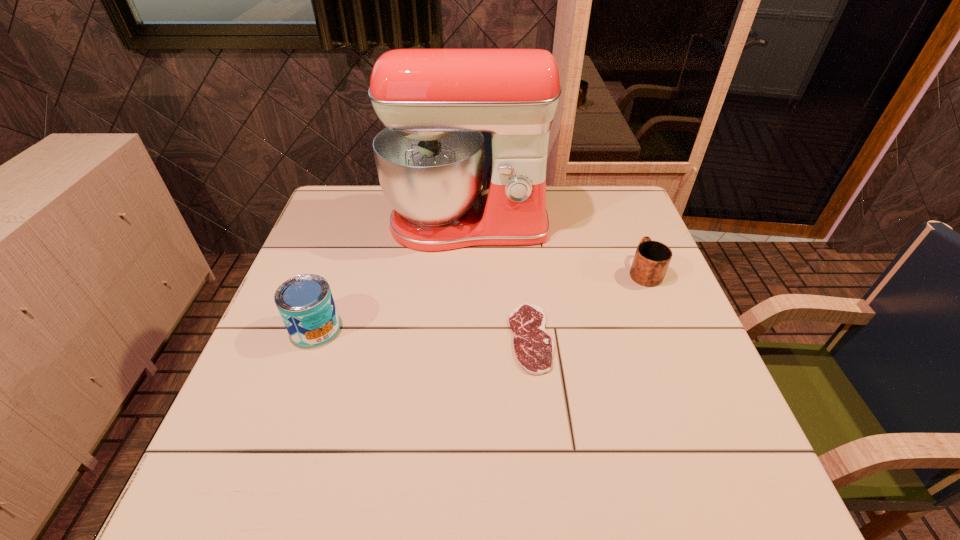
Find the location of a particular element. Image resolution: width=960 pixels, height=540 pixels. unoccupied area between the shortest object and the mixer is located at coordinates (499, 281).

Identify which object is located as the second nearest to the steak. Please provide its 2D coordinates. Your answer should be formatted as a tuple, i.e. [(x, y)], where the tuple contains the x and y coordinates of a point satisfying the conditions above.

[(652, 258)]

The width and height of the screenshot is (960, 540). In order to click on the closest object to the can in this screenshot , I will do `click(435, 103)`.

Where is `free spot that satisfies the following two spatial constraints: 1. on the front-facing side of the shortest object; 2. on the left side of the mixer`? Image resolution: width=960 pixels, height=540 pixels. free spot that satisfies the following two spatial constraints: 1. on the front-facing side of the shortest object; 2. on the left side of the mixer is located at coordinates (464, 338).

The height and width of the screenshot is (540, 960). I want to click on vacant region that satisfies the following two spatial constraints: 1. on the front side of the can; 2. on the left side of the steak, so click(312, 338).